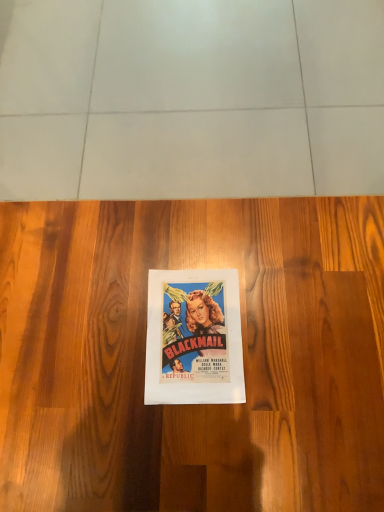
Question: Is wooden floor at center bigger or smaller than matte paper poster at center?

Choices:
 (A) big
 (B) small

Answer: (A)

Question: Is wooden floor at center in front of or behind matte paper poster at center in the image?

Choices:
 (A) front
 (B) behind

Answer: (A)

Question: Considering the positions of point (61, 308) and point (185, 352), is point (61, 308) closer or farther from the camera than point (185, 352)?

Choices:
 (A) closer
 (B) farther

Answer: (B)

Question: In the image, is matte paper poster at center positioned in front of or behind wooden floor at center?

Choices:
 (A) front
 (B) behind

Answer: (B)

Question: Does point (241, 354) appear closer or farther from the camera than point (120, 279)?

Choices:
 (A) closer
 (B) farther

Answer: (A)

Question: Which is correct: matte paper poster at center is inside wooden floor at center, or outside of it?

Choices:
 (A) outside
 (B) inside

Answer: (B)

Question: Is matte paper poster at center taller or shorter than wooden floor at center?

Choices:
 (A) short
 (B) tall

Answer: (A)